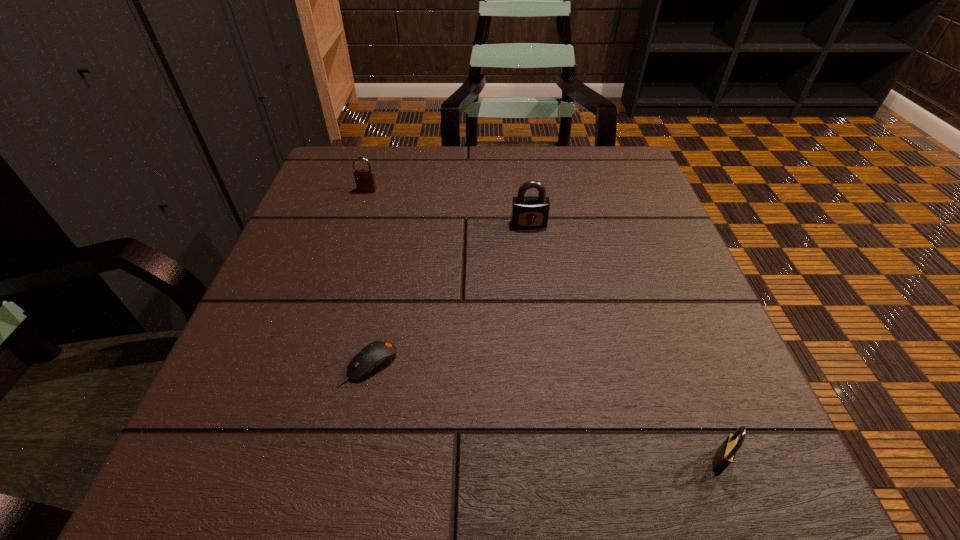
Locate an element on the screen. unoccupied position between the nearest padlock and the computer mouse is located at coordinates (544, 413).

In order to click on vacant area that lies between the nearest object and the second nearest padlock in this screenshot , I will do `click(624, 342)`.

Locate an element on the screen. vacant area between the third object from left to right and the farthest object is located at coordinates (448, 207).

Where is `vacant area between the second object from right to left and the farthest object`? The width and height of the screenshot is (960, 540). vacant area between the second object from right to left and the farthest object is located at coordinates (448, 207).

Locate an element on the screen. Image resolution: width=960 pixels, height=540 pixels. the closest object to the computer mouse is located at coordinates (528, 212).

Locate which object is the third closest to the third farthest object. Please provide its 2D coordinates. Your answer should be formatted as a tuple, i.e. [(x, y)], where the tuple contains the x and y coordinates of a point satisfying the conditions above.

[(725, 454)]

Identify the location of the third closest padlock to the third object from right to left. (725, 454).

Choose which padlock is the second nearest neighbor to the shortest object. Please provide its 2D coordinates. Your answer should be formatted as a tuple, i.e. [(x, y)], where the tuple contains the x and y coordinates of a point satisfying the conditions above.

[(365, 180)]

Find the location of a particular element. This screenshot has height=540, width=960. vacant space that satisfies the following two spatial constraints: 1. on the front-facing side of the nearest padlock; 2. on the left side of the leftmost object is located at coordinates (281, 461).

Image resolution: width=960 pixels, height=540 pixels. Find the location of `free space that satisfies the following two spatial constraints: 1. on the front-facing side of the shortest object; 2. on the right side of the leftmost object`. free space that satisfies the following two spatial constraints: 1. on the front-facing side of the shortest object; 2. on the right side of the leftmost object is located at coordinates (312, 365).